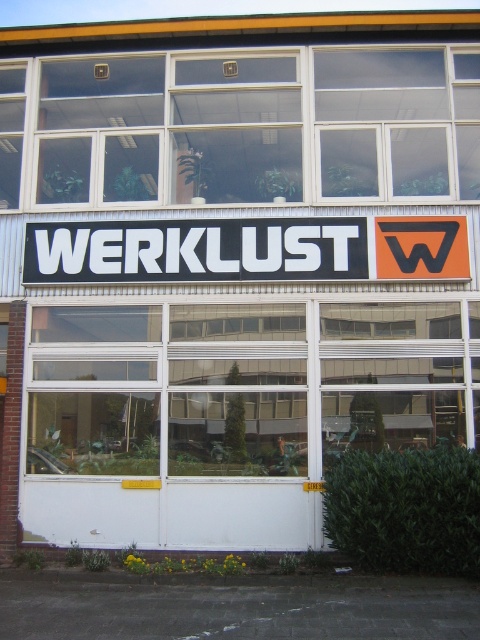
Does clear glass window at center come behind black plastic sign at center?

Yes, clear glass window at center is further from the viewer.

Find the location of a particular element. This screenshot has width=480, height=640. clear glass window at center is located at coordinates (240, 125).

Find the location of a particular element. This screenshot has height=640, width=480. clear glass window at center is located at coordinates (240, 125).